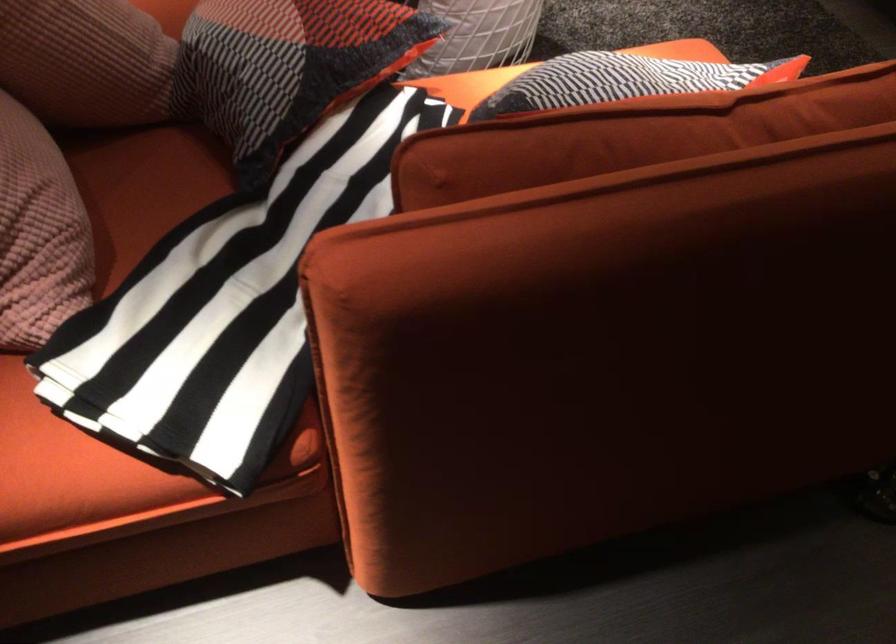
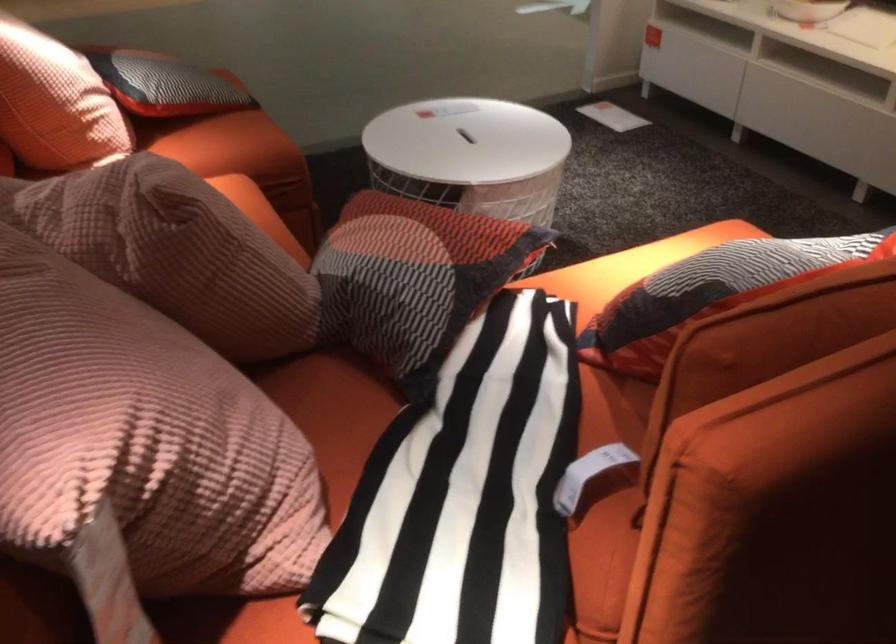
Question: The images are taken continuously from a first-person perspective. In which direction are you moving?

Choices:
 (A) Left
 (B) Right
 (C) Forward
 (D) Backward

Answer: (A)